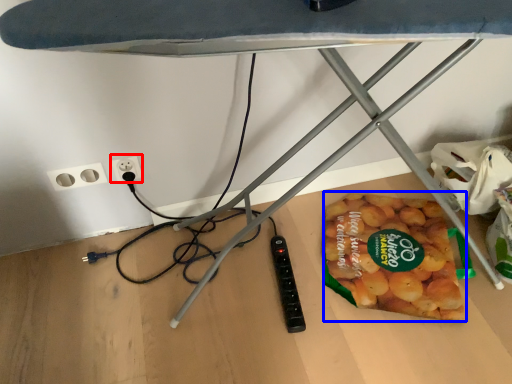
Question: Which object is further to the camera taking this photo, electric outlet (highlighted by a red box) or snack (highlighted by a blue box)?

Choices:
 (A) electric outlet
 (B) snack

Answer: (A)